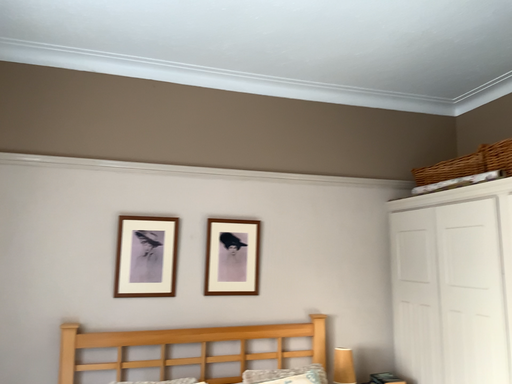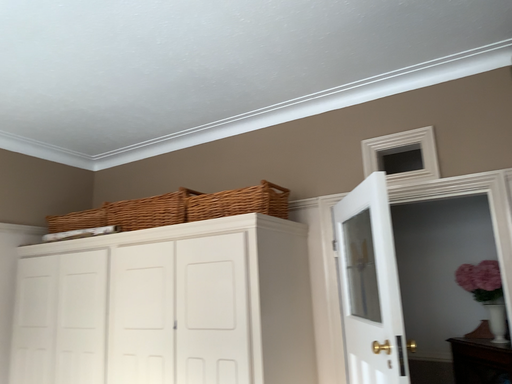
Question: How did the camera likely rotate when shooting the video?

Choices:
 (A) rotated right
 (B) rotated left

Answer: (A)